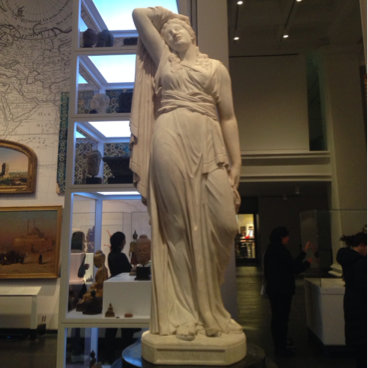
Where is `ceiling`? The width and height of the screenshot is (368, 368). ceiling is located at coordinates (314, 30).